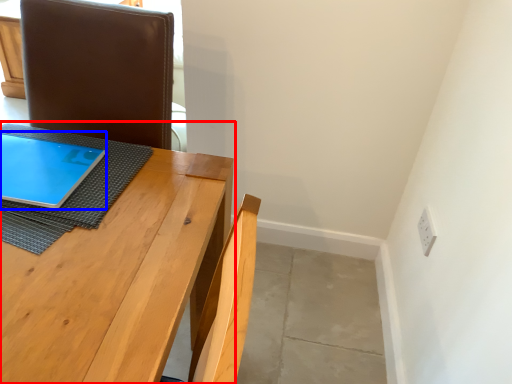
Question: Which object appears farthest to the camera in this image, table (highlighted by a red box) or tablet computer (highlighted by a blue box)?

Choices:
 (A) table
 (B) tablet computer

Answer: (B)